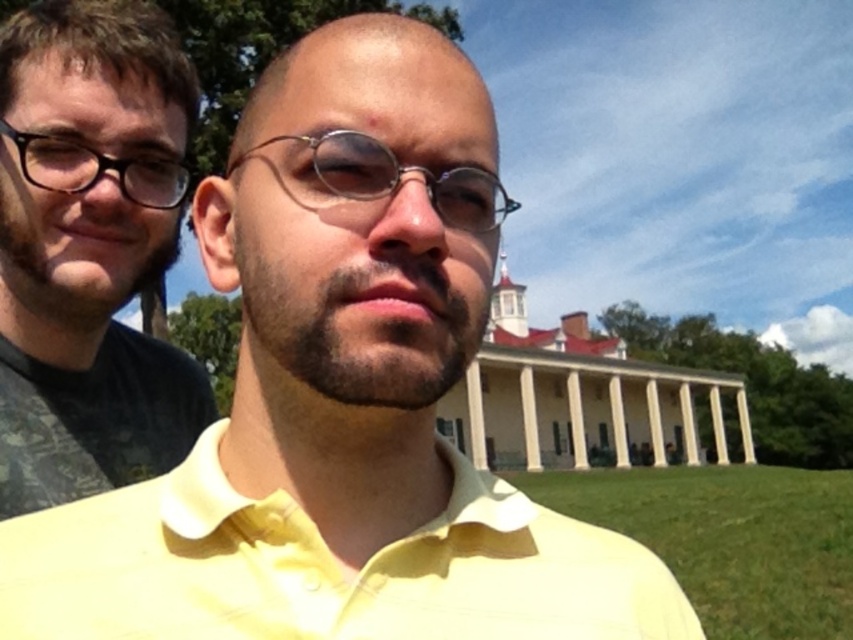
You are a photographer trying to capture both the yellow cotton polo shirt at center and the matte black shirt at left in a single frame. Based on their heights, which shirt should you focus on to ensure both are fully visible in the photo?

The yellow cotton polo shirt at center is shorter than the matte black shirt at left. To ensure both are fully visible, focus on the matte black shirt at left as it is taller, allowing the shorter yellow cotton polo shirt at center to be captured within the frame.